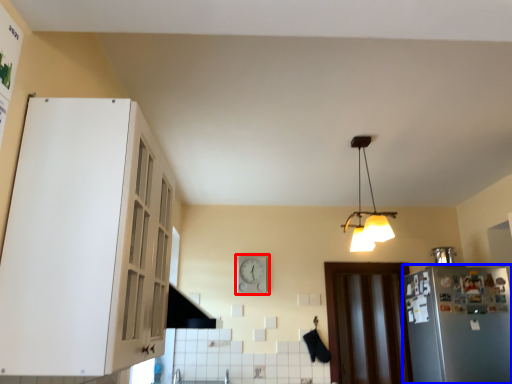
Question: Which of the following is the closest to the observer, clock (highlighted by a red box) or refrigerator (highlighted by a blue box)?

Choices:
 (A) clock
 (B) refrigerator

Answer: (B)